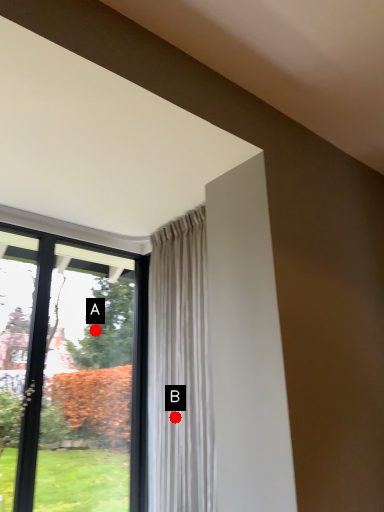
Question: Two points are circled on the image, labeled by A and B beside each circle. Which of the following is the closest to the observer?

Choices:
 (A) A is closer
 (B) B is closer

Answer: (B)